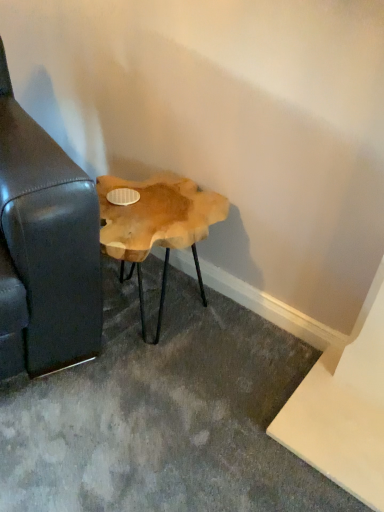
Question: Is black leather couch at left surrounding natural wood side table at lower left?

Choices:
 (A) no
 (B) yes

Answer: (A)

Question: From a real-world perspective, is black leather couch at left positioned under natural wood side table at lower left based on gravity?

Choices:
 (A) no
 (B) yes

Answer: (A)

Question: Considering the relative positions of black leather couch at left and natural wood side table at lower left in the image provided, is black leather couch at left to the right of natural wood side table at lower left from the viewer's perspective?

Choices:
 (A) no
 (B) yes

Answer: (A)

Question: Is black leather couch at left aimed at natural wood side table at lower left?

Choices:
 (A) yes
 (B) no

Answer: (B)

Question: Is black leather couch at left directly adjacent to natural wood side table at lower left?

Choices:
 (A) no
 (B) yes

Answer: (A)

Question: Is black leather couch at left not inside natural wood side table at lower left?

Choices:
 (A) yes
 (B) no

Answer: (A)

Question: From the image's perspective, is natural wood side table at lower left located above black leather couch at left?

Choices:
 (A) yes
 (B) no

Answer: (B)

Question: Is the position of natural wood side table at lower left more distant than that of black leather couch at left?

Choices:
 (A) no
 (B) yes

Answer: (B)

Question: Could you tell me if natural wood side table at lower left is turned towards black leather couch at left?

Choices:
 (A) yes
 (B) no

Answer: (B)

Question: From a real-world perspective, is natural wood side table at lower left below black leather couch at left?

Choices:
 (A) no
 (B) yes

Answer: (B)

Question: Does natural wood side table at lower left have a lesser width compared to black leather couch at left?

Choices:
 (A) no
 (B) yes

Answer: (B)

Question: Is natural wood side table at lower left smaller than black leather couch at left?

Choices:
 (A) yes
 (B) no

Answer: (A)

Question: Is black leather couch at left wider or thinner than natural wood side table at lower left?

Choices:
 (A) wide
 (B) thin

Answer: (A)